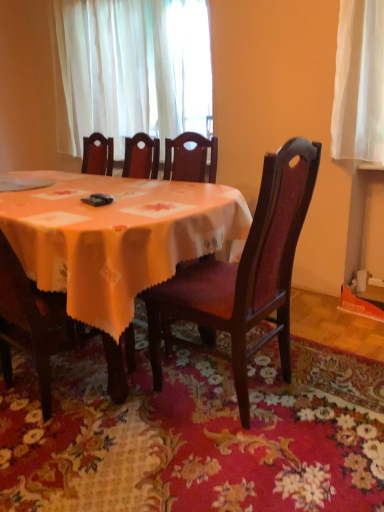
I want to click on unoccupied region to the right of wooden chair at center, the first chair when ordered from left to right, so click(146, 411).